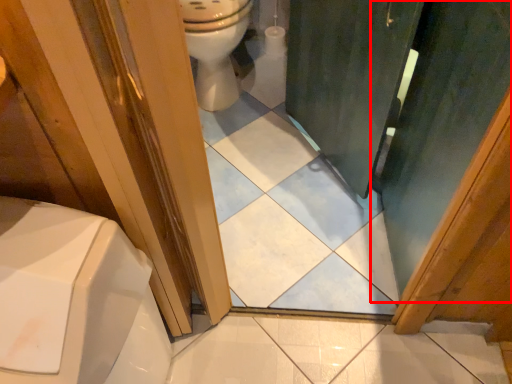
Question: From the image's perspective, considering the relative positions of screen door (annotated by the red box) and toilet in the image provided, where is screen door (annotated by the red box) located with respect to the staircase?

Choices:
 (A) above
 (B) below

Answer: (B)